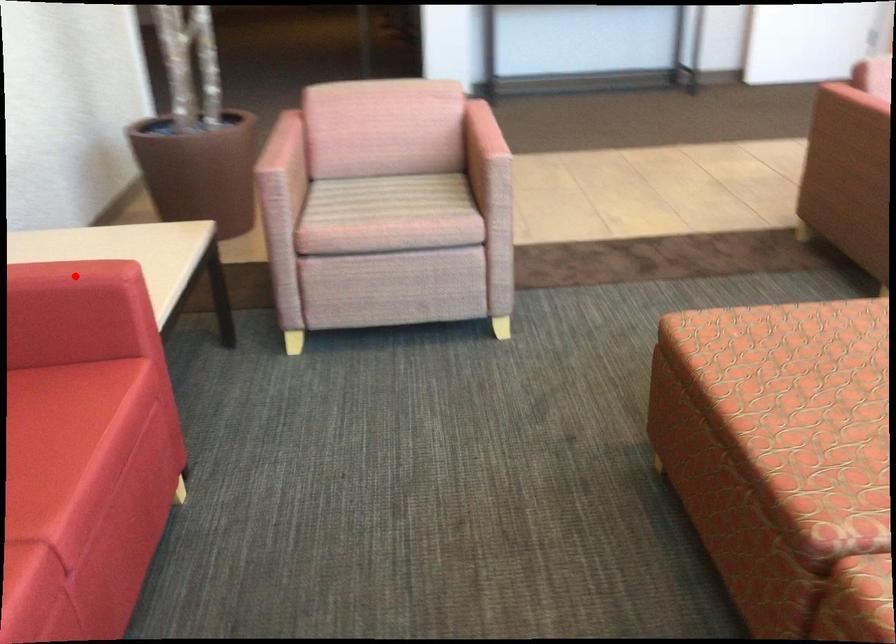
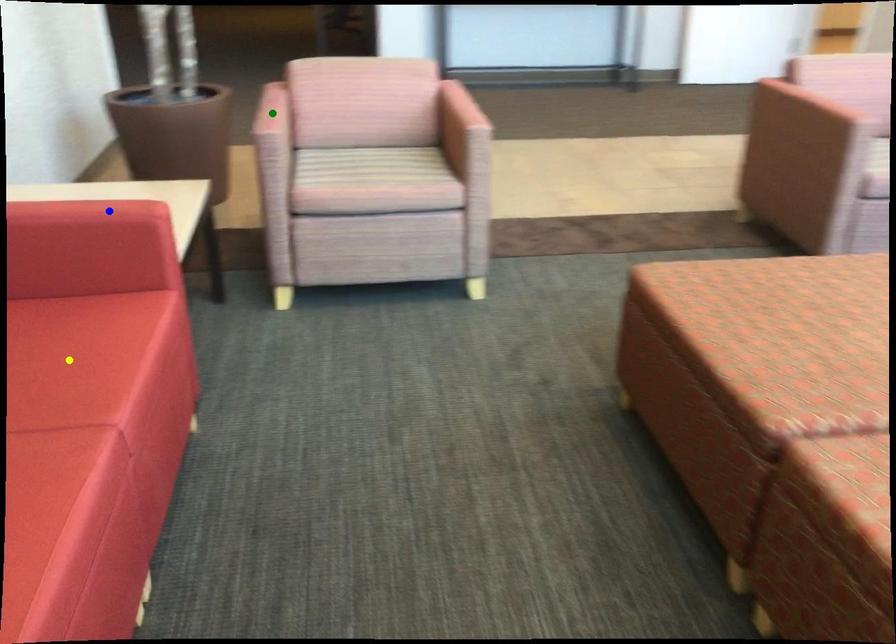
Question: I am providing you with two images of the same scene from different viewpoints. A red point is marked on the first image. You are given multiple points on the second image. Which point in image 2 is actually the same real-world point as the red point in image 1?

Choices:
 (A) yellow point
 (B) blue point
 (C) green point

Answer: (B)